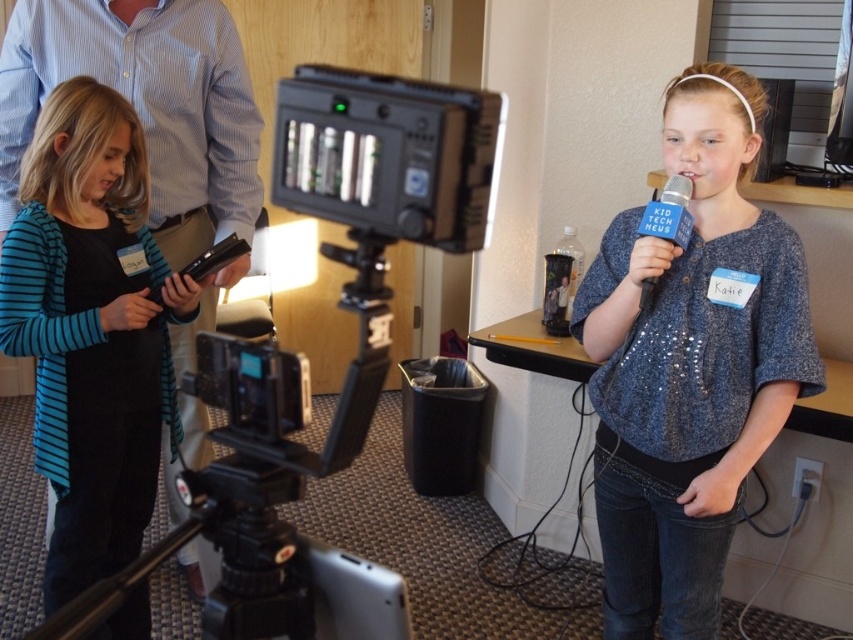
Where is the black plastic video camera at center located in the image?

Answer: The black plastic video camera at center is located at point coordinates of [306,360].

You are a photographer adjusting the camera to focus on the sparkly blue blouse at center and the blue fabric microphone at center. Which object should you zoom in on to capture more details of its width?

The sparkly blue blouse at center has a greater width than the blue fabric microphone at center, so you should zoom in on the sparkly blue blouse at center to capture more details of its width.

You are a photographer adjusting the camera focus. You need to focus on two points in the scene, point [654,556] and point [672,232]. Which point is closer to the camera?

Point [654,556] is closer to the camera because it is further to the viewer than point [672,232].